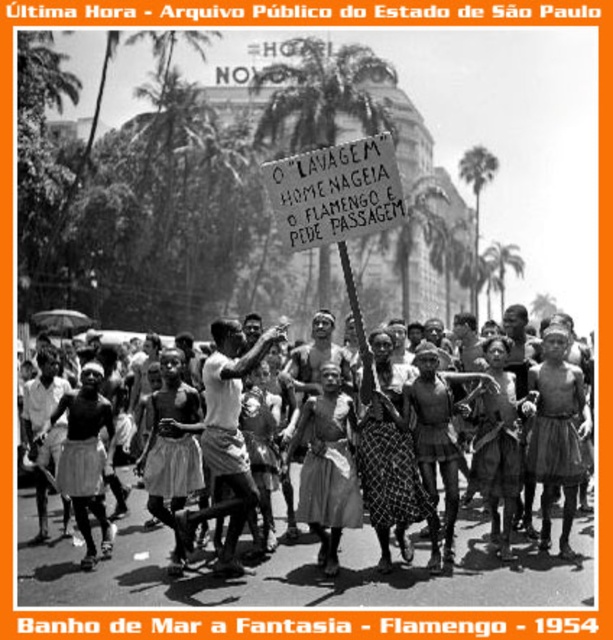
Consider the image. You are a photographer standing at the front of the scene. You want to take a photo of the wooden signboard at center and the light brown fabric skirt at center. The minimum distance between the two objects to ensure both are in focus is 10 meters. Can you capture both in focus with your current camera settings?

The wooden signboard at center is 14.41 meters away from the light brown fabric skirt at center. Since the minimum required distance for both to be in focus is 10 meters, the photographer can capture both in focus as the distance between them is sufficient.

You are a photographer at the event. You want to capture a photo where the wooden signboard at center is visible without being blocked by the light brown fabric skirt at center. Based on their positions, is this possible?

The wooden signboard at center is located above the light brown fabric skirt at center, so it is possible to capture a photo where the wooden signboard at center is visible without being blocked by the light brown fabric skirt at center.